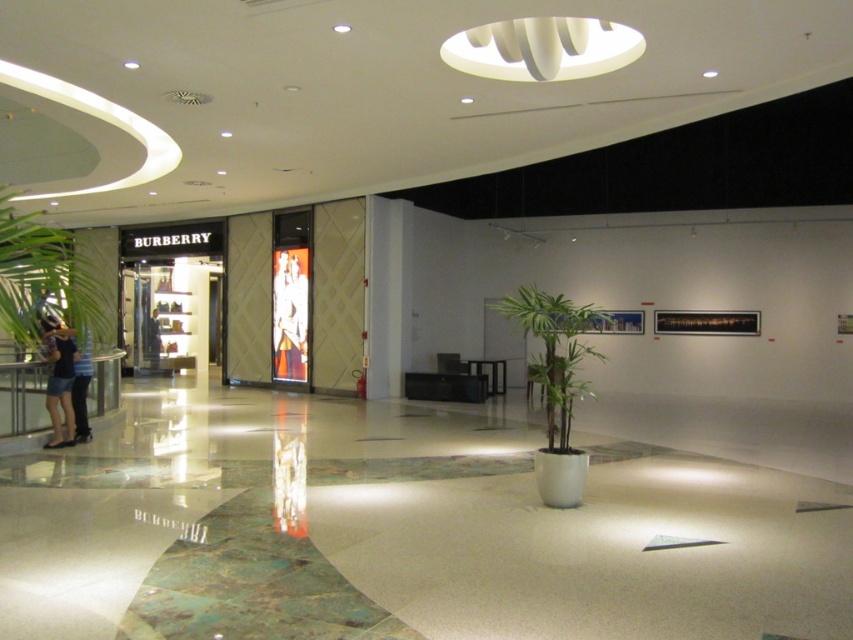
Question: Which object is positioned closest to the matte black mannequin at center?

Choices:
 (A) green leafy plant at center
 (B) denim shorts at left

Answer: (A)

Question: Which object is positioned closest to the denim shorts at left?

Choices:
 (A) green leafy plant at center
 (B) denim pants at left
 (C) matte black mannequin at center

Answer: (B)

Question: Can you confirm if green leafy plant at center is thinner than denim pants at left?

Choices:
 (A) no
 (B) yes

Answer: (A)

Question: Which point is closer to the camera?

Choices:
 (A) denim shorts at left
 (B) matte black mannequin at center

Answer: (A)

Question: Is green leafy plant at center to the right of matte black mannequin at center from the viewer's perspective?

Choices:
 (A) yes
 (B) no

Answer: (A)

Question: Does green leafy plant at center appear under denim pants at left?

Choices:
 (A) no
 (B) yes

Answer: (A)